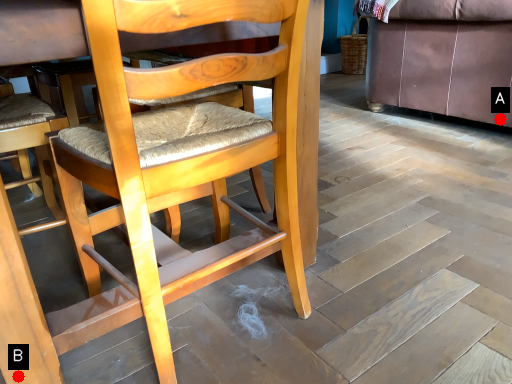
Question: Two points are circled on the image, labeled by A and B beside each circle. Which point is closer to the camera?

Choices:
 (A) A is closer
 (B) B is closer

Answer: (B)